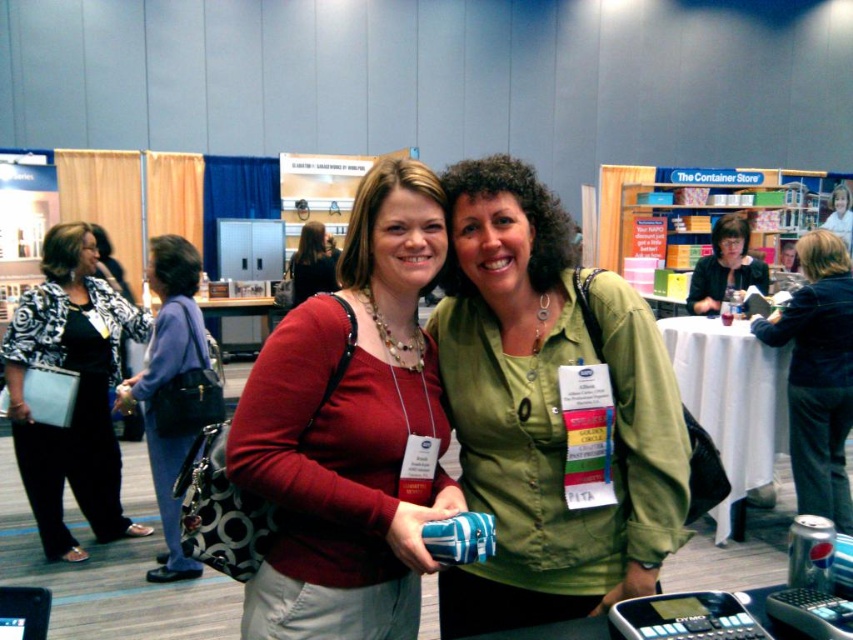
Question: Which is farther from the dark blue denim jacket at center?

Choices:
 (A) matte black purse at left
 (B) matte black shirt at center

Answer: (A)

Question: Is black and white patterned blazer at left smaller than matte black shirt at center?

Choices:
 (A) yes
 (B) no

Answer: (B)

Question: Among these points, which one is nearest to the camera?

Choices:
 (A) (805, 460)
 (B) (177, 342)

Answer: (B)

Question: Is matte red shirt at center bigger than clear plastic bottle at center?

Choices:
 (A) no
 (B) yes

Answer: (B)

Question: Which is nearer to the matte black shirt at center?

Choices:
 (A) black and white patterned blazer at left
 (B) matte black purse at left
 (C) dark blue denim jacket at center

Answer: (C)

Question: Is green matte shirt at center bigger than matte black purse at center?

Choices:
 (A) no
 (B) yes

Answer: (A)